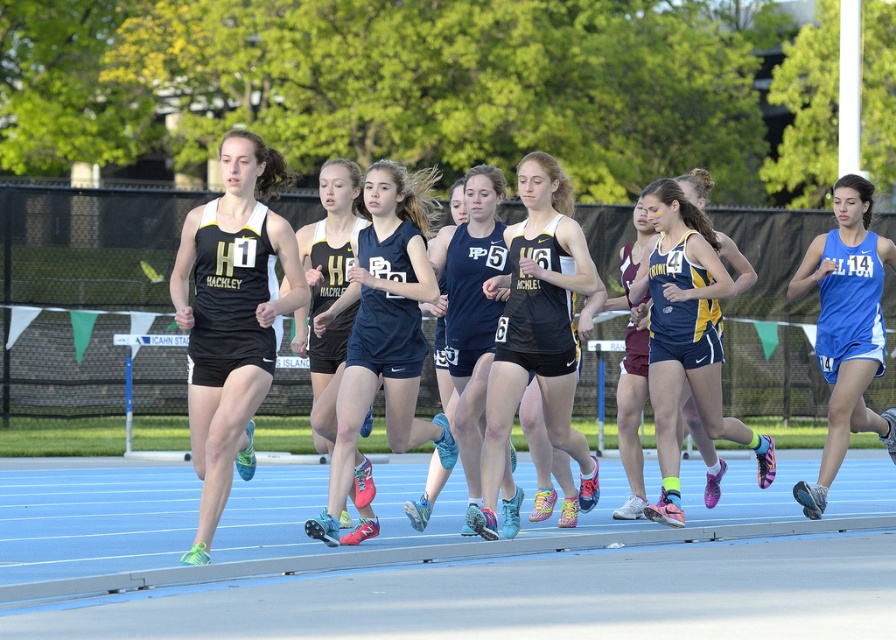
Question: Considering the real-world distances, which object is farthest from the black matte tank top at left?

Choices:
 (A) matte blue tank top at center
 (B) matte black shorts at center
 (C) black matte tank top at center

Answer: (A)

Question: Is black matte tank top at left behind matte black shorts at center?

Choices:
 (A) yes
 (B) no

Answer: (B)

Question: Considering the real-world distances, which object is farthest from the matte blue tank top at center?

Choices:
 (A) matte black shorts at center
 (B) black matte tank top at center
 (C) black matte shorts at center
 (D) black matte tank top at left

Answer: (D)

Question: Where is blue and yellow athletic uniform at center located in relation to matte black shorts at center in the image?

Choices:
 (A) left
 (B) right

Answer: (B)

Question: Is the position of black matte tank top at left less distant than that of matte black shorts at center?

Choices:
 (A) yes
 (B) no

Answer: (A)

Question: Which point is farther to the camera?

Choices:
 (A) (682, 342)
 (B) (237, 364)

Answer: (A)